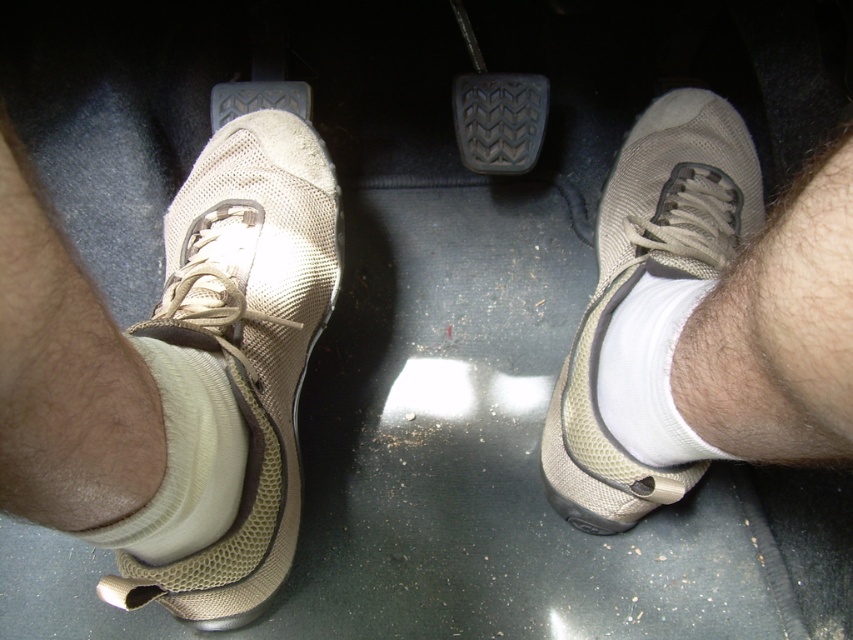
You are a mechanic inspecting the pedals of a car. You notice a point marked at coordinates (184, 460). Based on the scene description, what object is located at this coordinate?

The point at (184, 460) indicates the white fabric sock at lower left.